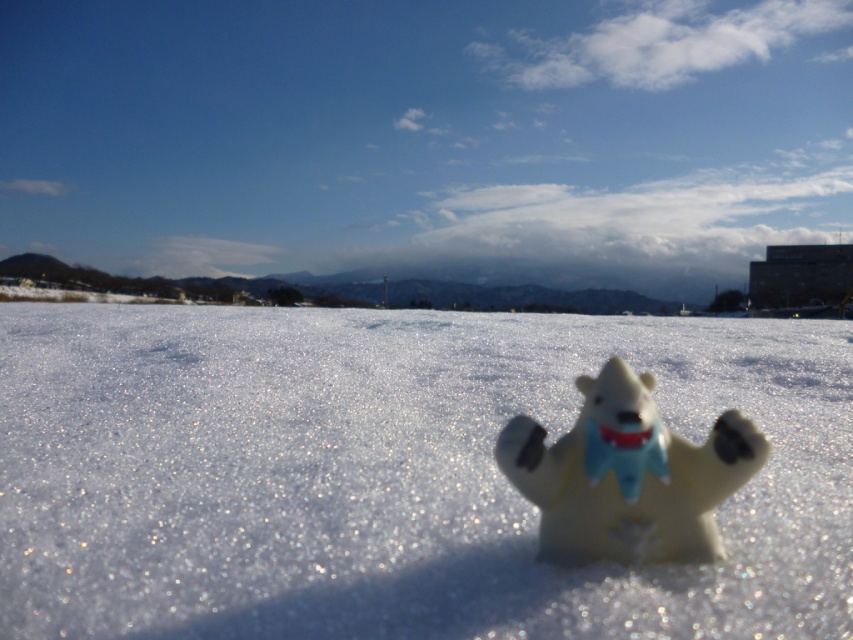
Does white matte snow at center lie behind white plastic bear at center?

No, it is not.

Is white matte snow at center wider than white plastic bear at center?

Yes, white matte snow at center is wider than white plastic bear at center.

Who is more distant from viewer, (137, 464) or (659, 513)?

Point (137, 464)

Where is `white matte snow at center`? This screenshot has width=853, height=640. white matte snow at center is located at coordinates pos(390,474).